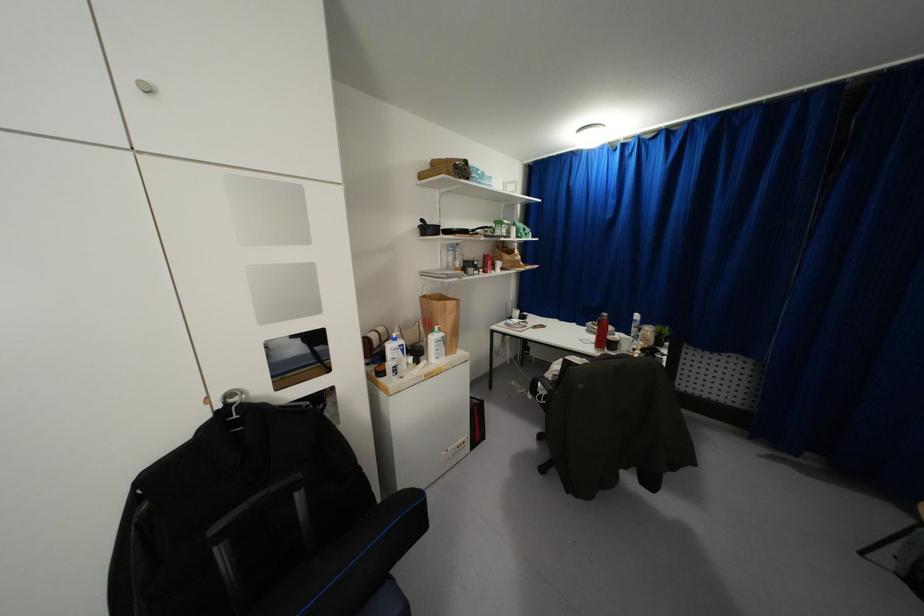
Find where to lift the red thermos. Please return your answer as a coordinate pair (x, y).

(601, 331)